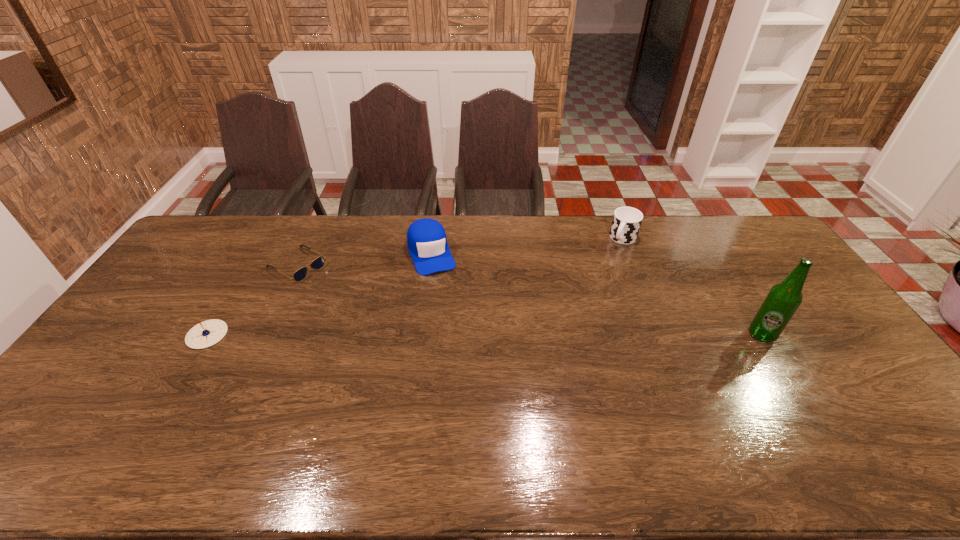
The height and width of the screenshot is (540, 960). I want to click on free spot located 0.330m on the front-facing side of the third object from left to right, so click(x=465, y=348).

This screenshot has width=960, height=540. What are the coordinates of `free space located 0.270m on the front-facing side of the third object from left to right` in the screenshot? It's located at (459, 333).

Where is `free space located 0.120m on the front-facing side of the third object from left to right`? This screenshot has width=960, height=540. free space located 0.120m on the front-facing side of the third object from left to right is located at coordinates (445, 299).

The width and height of the screenshot is (960, 540). Identify the location of vacant space situated on the front-facing side of the shortest object. [402, 331].

I want to click on free location located 0.250m on the front-facing side of the shortest object, so coord(368,309).

Where is `vacant point located 0.140m on the front-facing side of the shortest object`? vacant point located 0.140m on the front-facing side of the shortest object is located at coordinates (344, 294).

Find the location of a particular element. The image size is (960, 540). free point located 0.320m on the side of the fourth object from left to right with the handle is located at coordinates (585, 300).

This screenshot has height=540, width=960. I want to click on free space located on the side of the fourth object from left to right with the handle, so click(x=612, y=259).

You are a GUI agent. You are given a task and a screenshot of the screen. Output one action in this format:
    pyautogui.click(x=<x>, y=<y>)
    Task: Click on the vacant position located on the side of the fourth object from left to right with the handle
    The height and width of the screenshot is (540, 960).
    Given the screenshot: What is the action you would take?
    pyautogui.click(x=588, y=294)

I want to click on baseball cap at the far edge, so click(x=426, y=238).